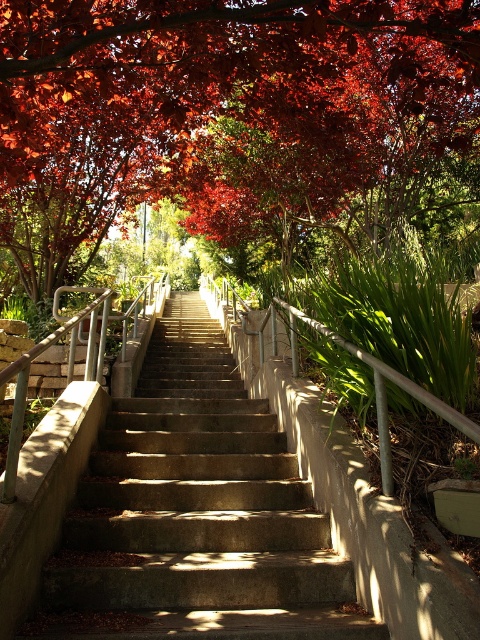
Question: Can you confirm if shiny red leaves at upper center is positioned above concrete stairs at center?

Choices:
 (A) no
 (B) yes

Answer: (B)

Question: Considering the relative positions of shiny red leaves at upper center and concrete stairs at center in the image provided, where is shiny red leaves at upper center located with respect to concrete stairs at center?

Choices:
 (A) above
 (B) below

Answer: (A)

Question: Among these points, which one is farthest from the camera?

Choices:
 (A) (337, 122)
 (B) (216, 608)

Answer: (A)

Question: Among these objects, which one is farthest from the camera?

Choices:
 (A) shiny red leaves at upper center
 (B) concrete stairs at center

Answer: (A)

Question: Is shiny red leaves at upper center above concrete stairs at center?

Choices:
 (A) yes
 (B) no

Answer: (A)